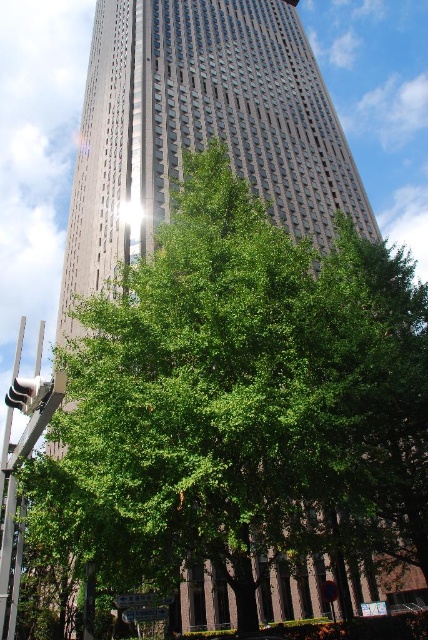
Which is more to the right, metallic gray pole at lower left or green plastic street sign at center?

Positioned to the right is green plastic street sign at center.

The image size is (428, 640). In order to click on metallic gray pole at lower left in this screenshot , I will do `click(5, 515)`.

Between point (18, 355) and point (124, 608), which one is positioned in front?

Positioned in front is point (124, 608).

Can you confirm if metallic gray pole at lower left is thinner than metallic street sign at center?

No, metallic gray pole at lower left is not thinner than metallic street sign at center.

Does point (9, 536) come farther from viewer compared to point (163, 596)?

No.

Identify the location of metallic gray pole at lower left. The height and width of the screenshot is (640, 428). (5, 515).

Is metallic street sign at center to the left of green plastic street sign at center from the viewer's perspective?

In fact, metallic street sign at center is to the right of green plastic street sign at center.

Is point (143, 602) more distant than point (157, 616)?

No, it is in front of (157, 616).

I want to click on metallic street sign at center, so click(142, 600).